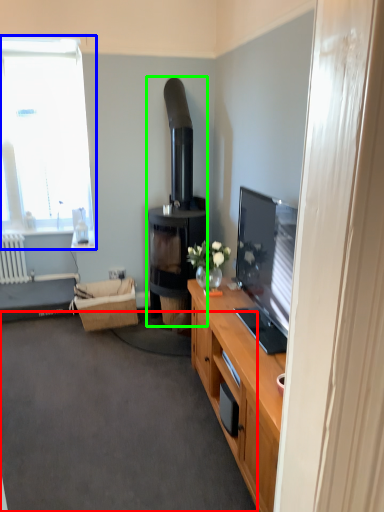
Question: Which object is positioned farthest from plain (highlighted by a red box)? Select from window (highlighted by a blue box) and fireplace (highlighted by a green box).

Choices:
 (A) window
 (B) fireplace

Answer: (A)